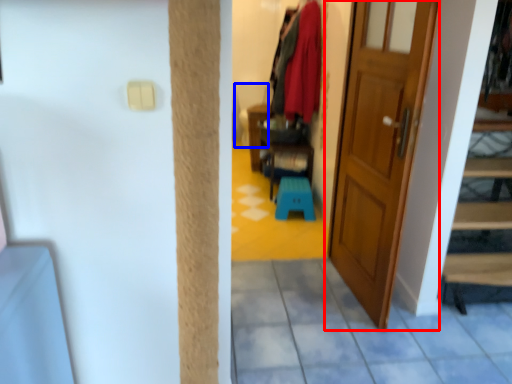
Question: Which object appears closest to the camera in this image, door (highlighted by a red box) or armchair (highlighted by a blue box)?

Choices:
 (A) door
 (B) armchair

Answer: (A)